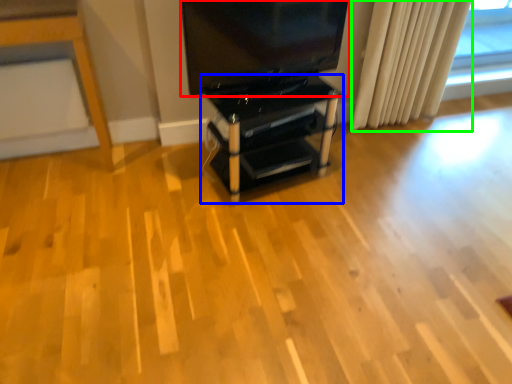
Question: Based on their relative distances, which object is nearer to television (highlighted by a red box)? Choose from furniture (highlighted by a blue box) and curtain (highlighted by a green box).

Choices:
 (A) furniture
 (B) curtain

Answer: (A)